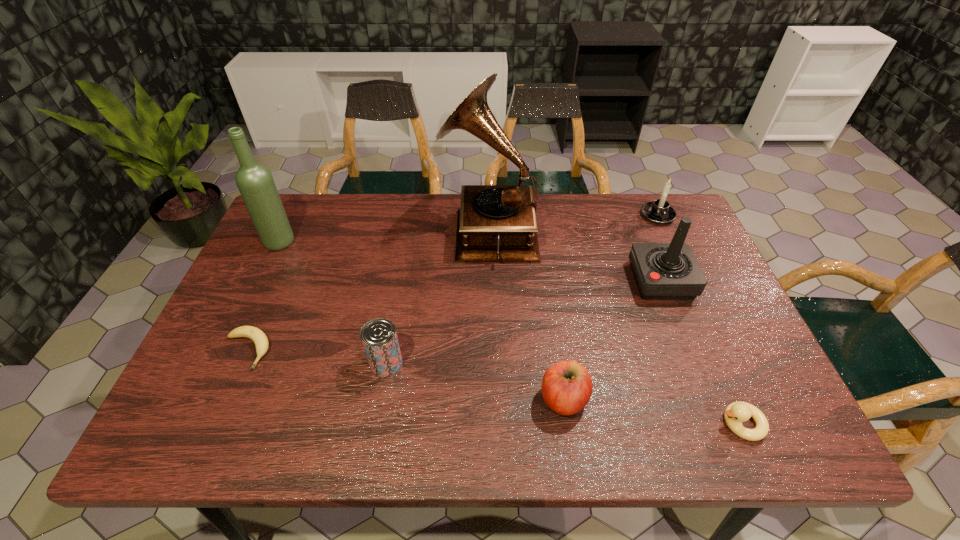
Locate an element on the screen. candle holder present at the right edge is located at coordinates (659, 211).

Locate an element on the screen. duckling at the right edge is located at coordinates (735, 413).

The height and width of the screenshot is (540, 960). What are the coordinates of `object located at the far left corner` in the screenshot? It's located at (255, 182).

Locate an element on the screen. object at the far right corner is located at coordinates (659, 211).

Locate an element on the screen. object at the near right corner is located at coordinates (735, 413).

At what (x,y) coordinates should I click in order to perform the action: click on free region at the far edge of the desktop. Please return your answer as a coordinate pair (x, y). Looking at the image, I should click on (419, 197).

This screenshot has height=540, width=960. Find the location of `vacant space at the near edge of the desktop`. vacant space at the near edge of the desktop is located at coordinates (667, 409).

Where is `free space at the left edge`? free space at the left edge is located at coordinates (281, 315).

In the image, there is a desktop. Where is `vacant space at the right edge`? The width and height of the screenshot is (960, 540). vacant space at the right edge is located at coordinates (714, 291).

This screenshot has width=960, height=540. What are the coordinates of `free space at the far left corner` in the screenshot? It's located at (318, 204).